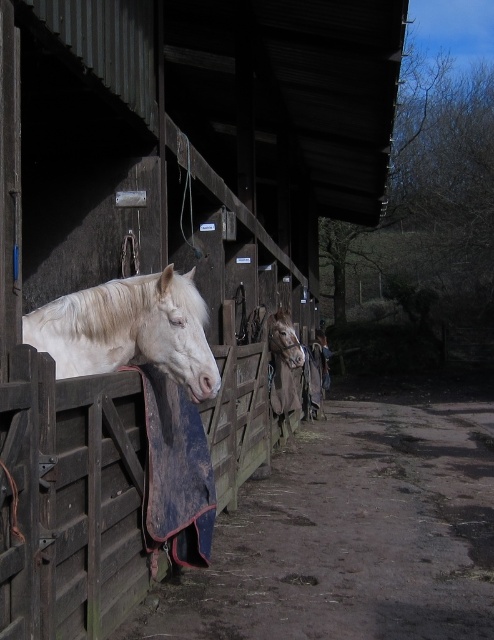
You are standing in the stable and want to determine which of the two points, point (x=114, y=404) or point (x=169, y=282), is closer to you. Based on the scene, which point is nearer?

Point (x=114, y=404) is closer to the camera than point (x=169, y=282), so it is the nearer point.

You are a farmer who needs to enter the stable to feed the horses. You see the wooden stable door at center and the white matte horse at center. Which object is located lower in the image?

The wooden stable door at center is located below the white matte horse at center, so the wooden stable door at center is lower in the image.